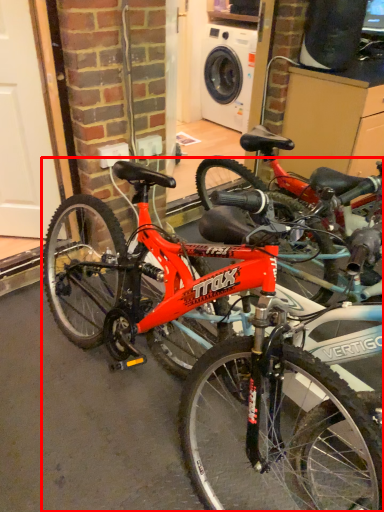
Question: In this image, where is bicycle (annotated by the red box) located relative to garage door?

Choices:
 (A) right
 (B) left

Answer: (A)